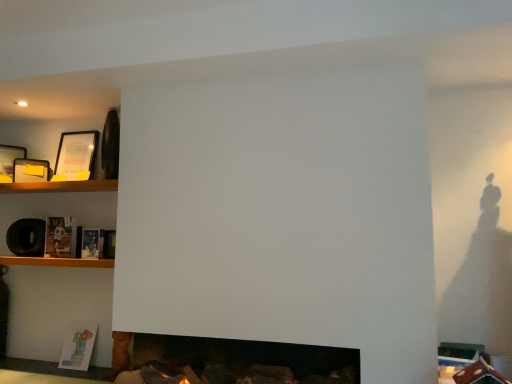
Question: Can you confirm if matte black picture frame at upper left, the third picture frame positioned from the left, is thinner than hardcover book at center-left, which is the 2th book in bottom-to-top order?

Choices:
 (A) yes
 (B) no

Answer: (B)

Question: Is the position of matte black picture frame at upper left, the third picture frame positioned from the left, more distant than that of hardcover book at center-left, which appears as the 2th book when viewed from the top?

Choices:
 (A) no
 (B) yes

Answer: (B)

Question: Is matte black picture frame at upper left, marked as the first picture frame in a right-to-left arrangement, positioned before hardcover book at center-left, which is the 2th book in bottom-to-top order?

Choices:
 (A) no
 (B) yes

Answer: (A)

Question: Is matte black picture frame at upper left, the third picture frame positioned from the left, outside of hardcover book at center-left, which appears as the 2th book when viewed from the top?

Choices:
 (A) no
 (B) yes

Answer: (B)

Question: From a real-world perspective, is matte black picture frame at upper left, marked as the first picture frame in a right-to-left arrangement, beneath hardcover book at center-left, which is the 2th book in bottom-to-top order?

Choices:
 (A) no
 (B) yes

Answer: (A)

Question: In terms of size, does wooden shelf at left, which ranks as the first shelf in top-to-bottom order, appear bigger or smaller than matte black picture frame at upper left, positioned as the 3th picture frame in right-to-left order?

Choices:
 (A) small
 (B) big

Answer: (B)

Question: Considering the positions of wooden shelf at left, which ranks as the first shelf in top-to-bottom order, and matte black picture frame at upper left, arranged as the 1th picture frame when viewed from the left, in the image, is wooden shelf at left, which ranks as the first shelf in top-to-bottom order, taller or shorter than matte black picture frame at upper left, arranged as the 1th picture frame when viewed from the left,?

Choices:
 (A) tall
 (B) short

Answer: (B)

Question: From a real-world perspective, is wooden shelf at left, which is counted as the second shelf, starting from the bottom, positioned above or below matte black picture frame at upper left, arranged as the 1th picture frame when viewed from the left?

Choices:
 (A) below
 (B) above

Answer: (A)

Question: Is wooden shelf at left, which ranks as the first shelf in top-to-bottom order, inside or outside of matte black picture frame at upper left, positioned as the 3th picture frame in right-to-left order?

Choices:
 (A) inside
 (B) outside

Answer: (B)

Question: From a real-world perspective, is wooden shelf at lower left, which is the 2th shelf from top to bottom, above or below matte black picture frame at upper left, positioned as the 3th picture frame in right-to-left order?

Choices:
 (A) above
 (B) below

Answer: (B)

Question: Is wooden shelf at lower left, which is the 2th shelf from top to bottom, inside the boundaries of matte black picture frame at upper left, positioned as the 3th picture frame in right-to-left order, or outside?

Choices:
 (A) outside
 (B) inside

Answer: (A)

Question: Considering the positions of wooden shelf at lower left, which ranks as the first shelf in bottom-to-top order, and matte black picture frame at upper left, positioned as the 3th picture frame in right-to-left order, in the image, is wooden shelf at lower left, which ranks as the first shelf in bottom-to-top order, taller or shorter than matte black picture frame at upper left, positioned as the 3th picture frame in right-to-left order,?

Choices:
 (A) tall
 (B) short

Answer: (B)

Question: Is wooden shelf at lower left, which ranks as the first shelf in bottom-to-top order, bigger or smaller than matte black picture frame at upper left, arranged as the 1th picture frame when viewed from the left?

Choices:
 (A) big
 (B) small

Answer: (A)

Question: From a real-world perspective, relative to matte black picture frame at left, which is counted as the second picture frame, starting from the left, is matte paper book at lower left, which is counted as the first book, starting from the bottom, vertically above or below?

Choices:
 (A) below
 (B) above

Answer: (A)

Question: Is point (81, 367) positioned closer to the camera than point (30, 170)?

Choices:
 (A) farther
 (B) closer

Answer: (B)